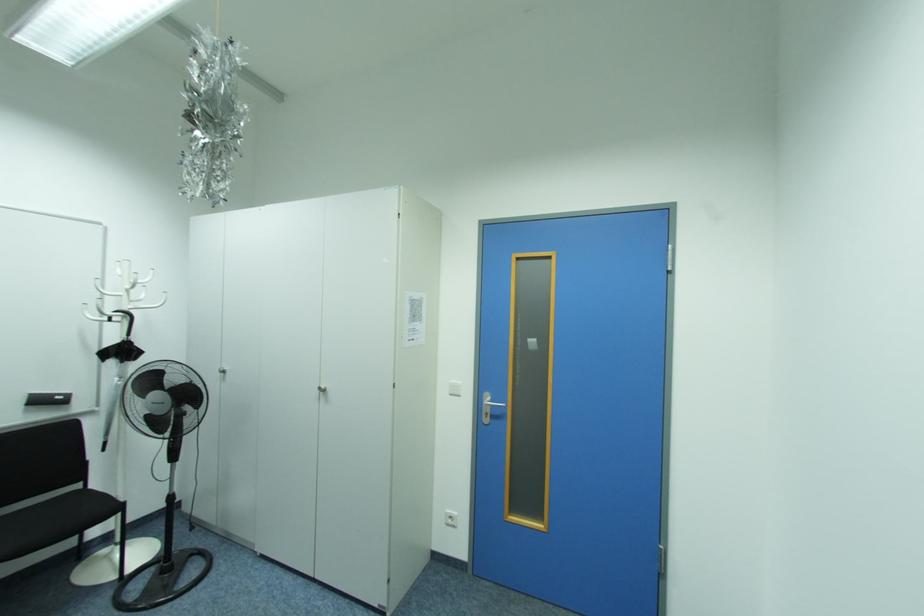
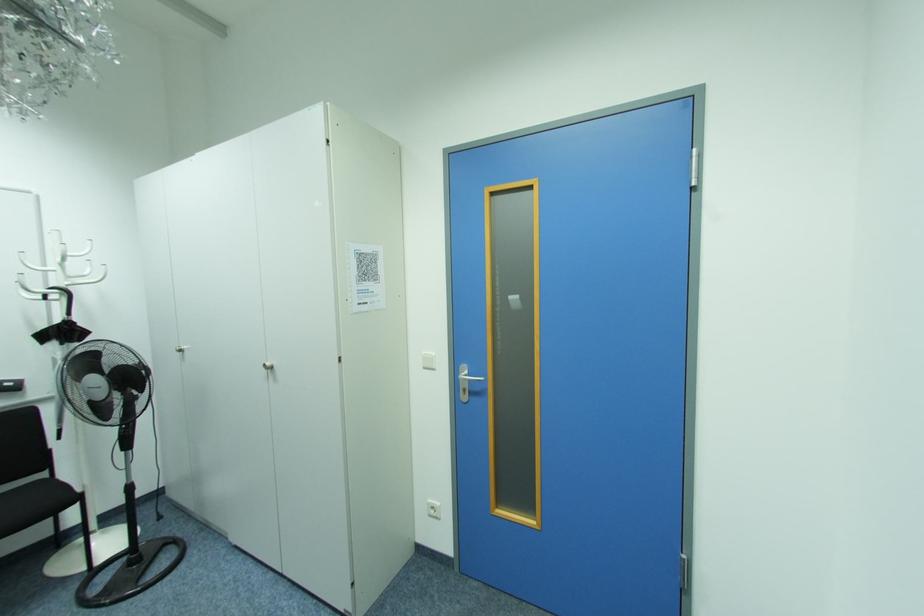
Question: The first image is from the beginning of the video and the second image is from the end. How did the camera likely rotate when shooting the video?

Choices:
 (A) Left
 (B) Right
 (C) Up
 (D) Down

Answer: (A)